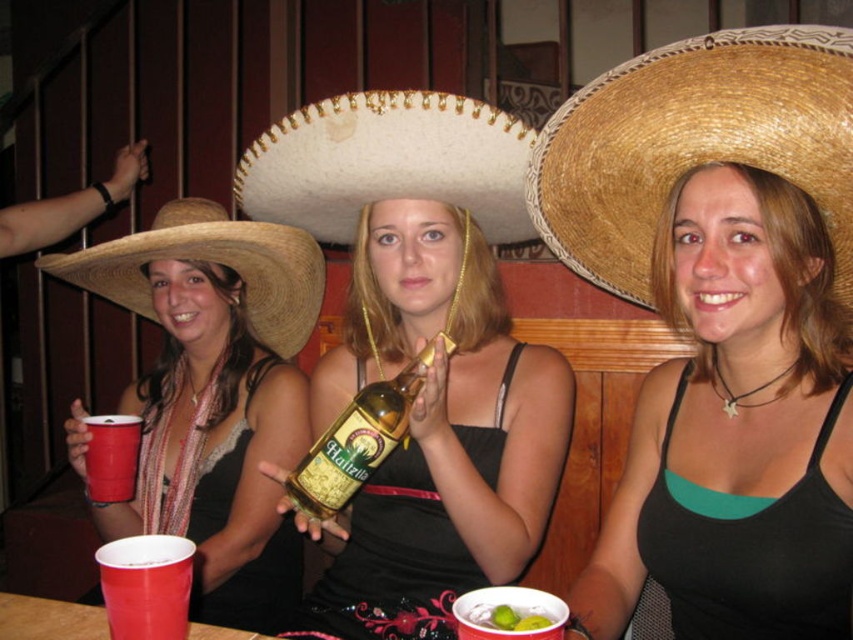
Question: Is the position of black matte tank top at center more distant than that of gold metallic bottle at center?

Choices:
 (A) no
 (B) yes

Answer: (A)

Question: Among these points, which one is nearest to the camera?

Choices:
 (A) (451, 340)
 (B) (166, 572)

Answer: (B)

Question: Among these objects, which one is farthest from the camera?

Choices:
 (A) gold metallic bottle at center
 (B) straw woven sombrero at right
 (C) matte straw sombrero at upper left
 (D) matte plastic cup at lower left

Answer: (C)

Question: Is white straw hat at center smaller than strawmaterial/texturecowboy hat at left?

Choices:
 (A) no
 (B) yes

Answer: (B)

Question: Which point is farther to the camera?

Choices:
 (A) straw woven sombrero at right
 (B) gold metallic bottle at center
 (C) matte gold bottle at center

Answer: (B)

Question: Does white straw hat at center have a larger size compared to gold metallic bottle at center?

Choices:
 (A) yes
 (B) no

Answer: (A)